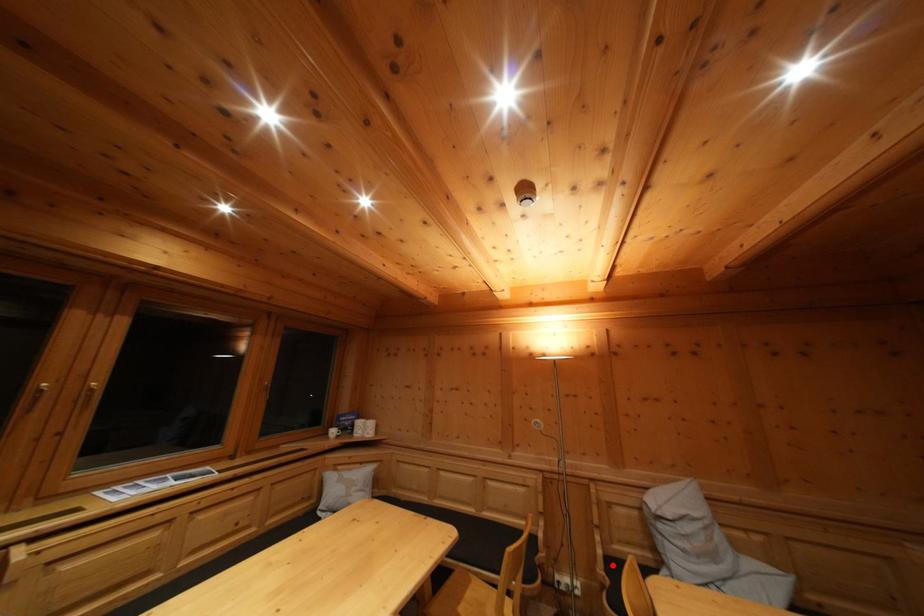
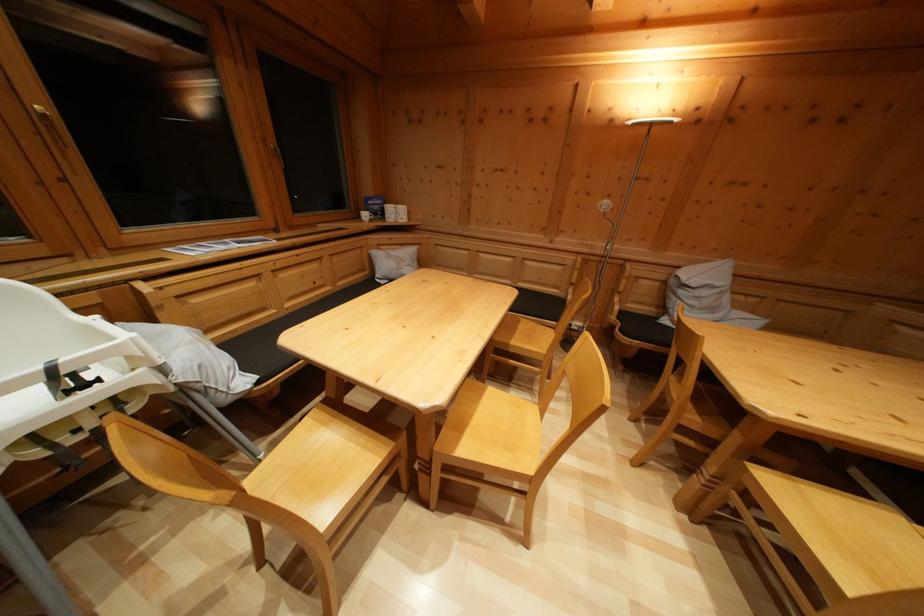
Question: I am providing you with two images of the same scene from different viewpoints. Image1 has a red point marked. In image2, the corresponding 3D location appears at what relative position? Reply with the corresponding letter.

Choices:
 (A) Closer
 (B) Farther

Answer: (A)